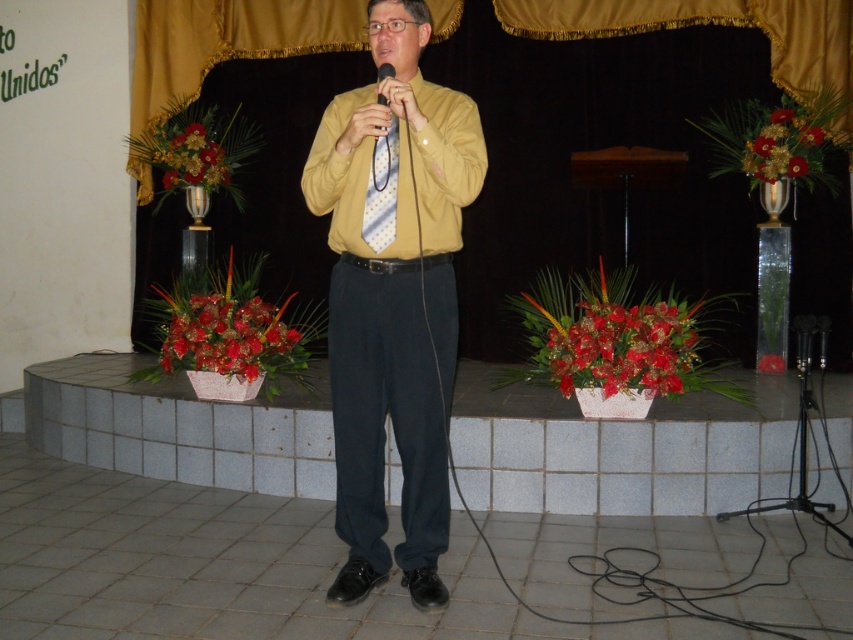
Question: Which object is farther from the camera taking this photo?

Choices:
 (A) yellow matte shirt at center
 (B) matte black microphone at center
 (C) shiny metallic vase at upper right
 (D) white dotted tie at center

Answer: (C)

Question: Considering the relative positions of glossy ceramic flower at center and matte black microphone at center in the image provided, where is glossy ceramic flower at center located with respect to matte black microphone at center?

Choices:
 (A) left
 (B) right

Answer: (A)

Question: Is yellow smooth dress shirt at center to the right of glossy floral arrangement at left from the viewer's perspective?

Choices:
 (A) yes
 (B) no

Answer: (A)

Question: Which point is farther to the camera?

Choices:
 (A) matte black microphone at center
 (B) glossy floral arrangement at left
 (C) gold fabric curtain at upper center

Answer: (B)

Question: Based on their relative distances, which object is nearer to the shiny red flowers at center?

Choices:
 (A) white dotted tie at center
 (B) yellow smooth dress shirt at center

Answer: (B)

Question: Does gold fabric curtain at upper center come in front of matte black microphone at center?

Choices:
 (A) yes
 (B) no

Answer: (B)